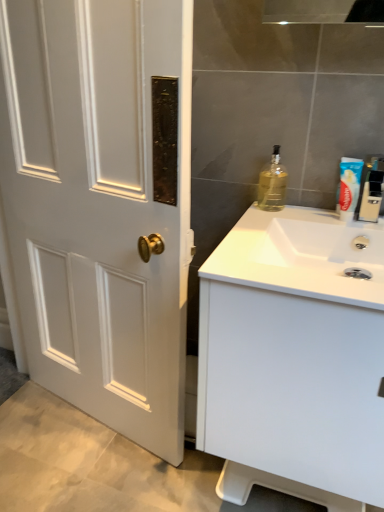
Where is `vacant area situated to the left side of blue plastic toothpaste at upper right`? This screenshot has height=512, width=384. vacant area situated to the left side of blue plastic toothpaste at upper right is located at coordinates (283, 216).